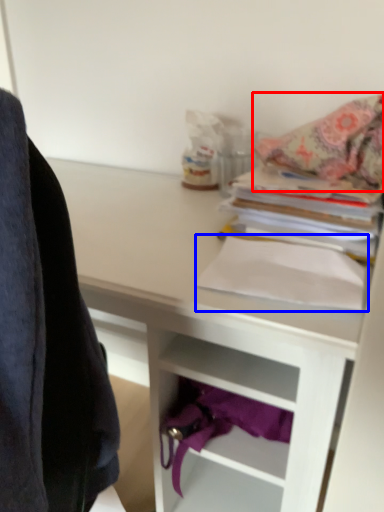
Question: Which object appears farthest to the camera in this image, blanket (highlighted by a red box) or paperback book (highlighted by a blue box)?

Choices:
 (A) blanket
 (B) paperback book

Answer: (A)